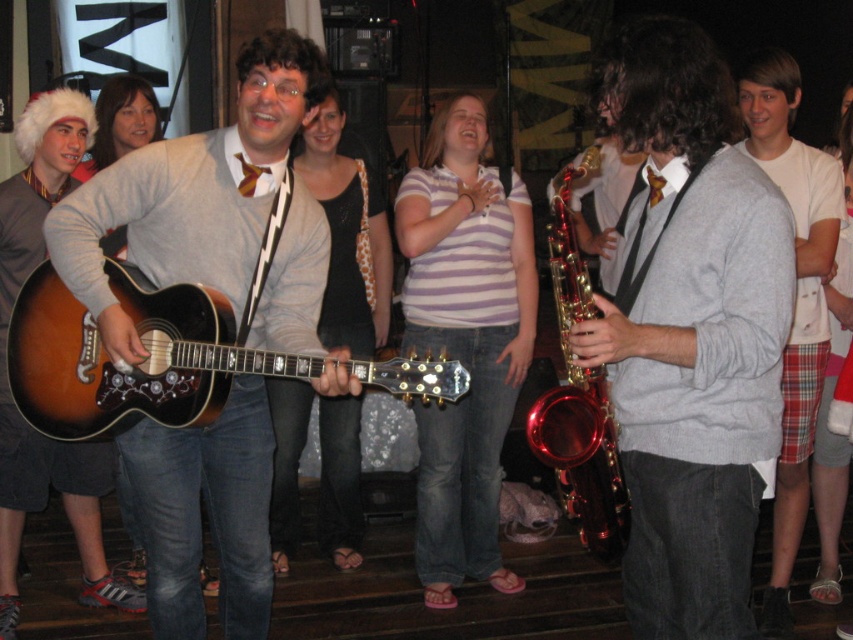
Looking at this image, you are planning to place a small table between the matte gray sweater at center and the matte brown guitar at left. The table requires 36 inches of space. Will there be enough space for the table?

The distance between the matte gray sweater at center and the matte brown guitar at left is 34.59 inches, which is less than the required 36 inches. Therefore, there is not enough space for the table.

You are at a party and want to take a photo of both the sunburst wood guitar at center and the metallic gold saxophone at center. If you stand facing the stage, which instrument should you point your camera to first to capture both in the frame?

You should point your camera to the sunburst wood guitar at center first since it is to the left of the metallic gold saxophone at center, so capturing it first ensures both are included in the frame when facing the stage.